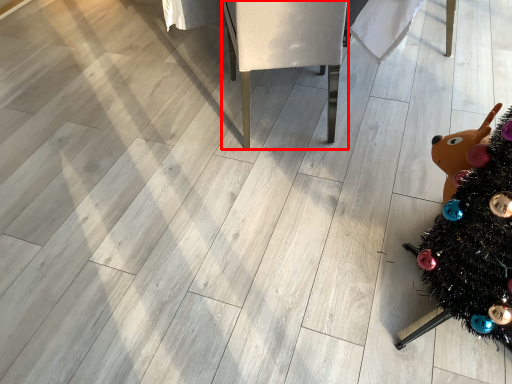
Question: From the image's perspective, what is the correct spatial positioning of furniture (annotated by the red box) in reference to christmas tree?

Choices:
 (A) below
 (B) above

Answer: (B)